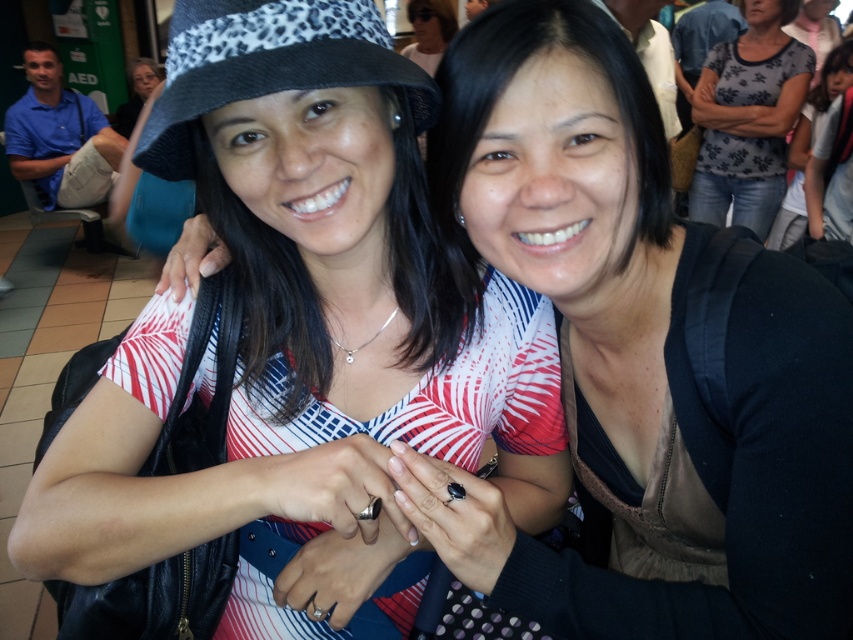
Can you confirm if white matte hat at upper left is positioned above floral-patterned shirt at upper right?

Incorrect, white matte hat at upper left is not positioned above floral-patterned shirt at upper right.

Measure the distance from white matte hat at upper left to floral-patterned shirt at upper right.

A distance of 2.72 meters exists between white matte hat at upper left and floral-patterned shirt at upper right.

What do you see at coordinates (302, 332) in the screenshot?
I see `white matte hat at upper left` at bounding box center [302, 332].

The height and width of the screenshot is (640, 853). Find the location of `white matte hat at upper left`. white matte hat at upper left is located at coordinates (302, 332).

Between black leopard print hat at upper left and floral-patterned shirt at upper right, which one is positioned lower?

Positioned lower is black leopard print hat at upper left.

Is point (422, 90) positioned before point (689, 211)?

Yes.

What do you see at coordinates (268, 65) in the screenshot? This screenshot has width=853, height=640. I see `black leopard print hat at upper left` at bounding box center [268, 65].

Where is `black leopard print hat at upper left`? The width and height of the screenshot is (853, 640). black leopard print hat at upper left is located at coordinates (268, 65).

Describe the element at coordinates (302, 332) in the screenshot. I see `white matte hat at upper left` at that location.

Looking at this image, who is more distant from viewer, (x=436, y=451) or (x=183, y=92)?

The point (x=436, y=451) is behind.

Locate an element on the screen. The width and height of the screenshot is (853, 640). white matte hat at upper left is located at coordinates (302, 332).